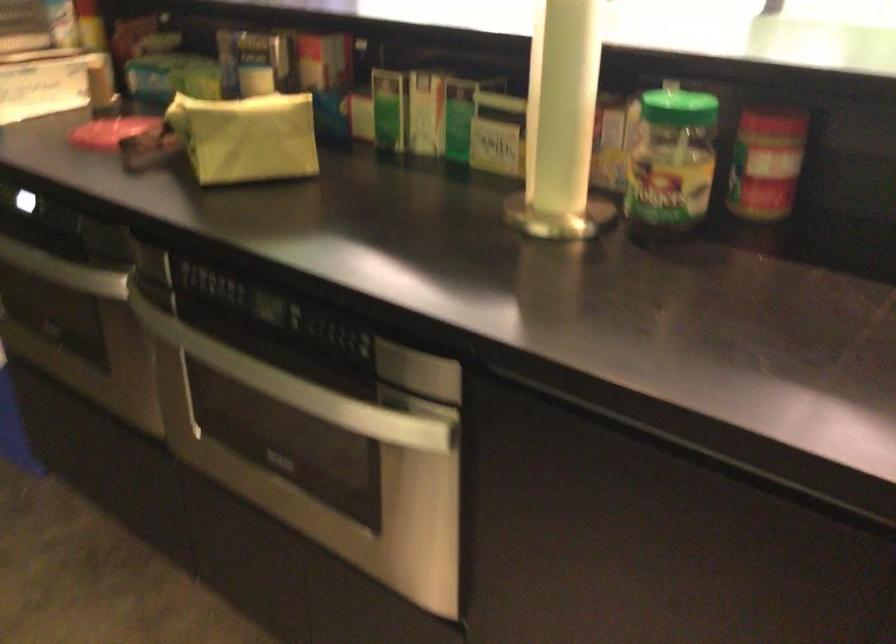
Where is `red jar lid`? This screenshot has height=644, width=896. red jar lid is located at coordinates (773, 116).